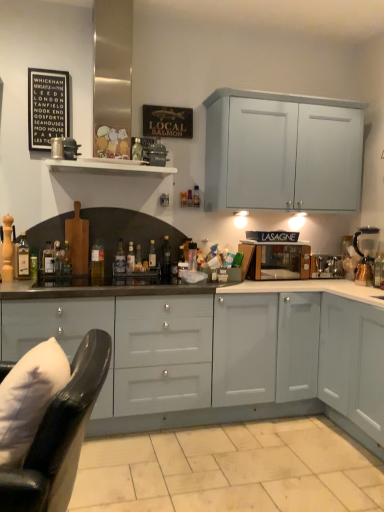
Locate an element on the screen. vacant point above beige tile at lower center (from a real-world perspective) is located at coordinates (236, 458).